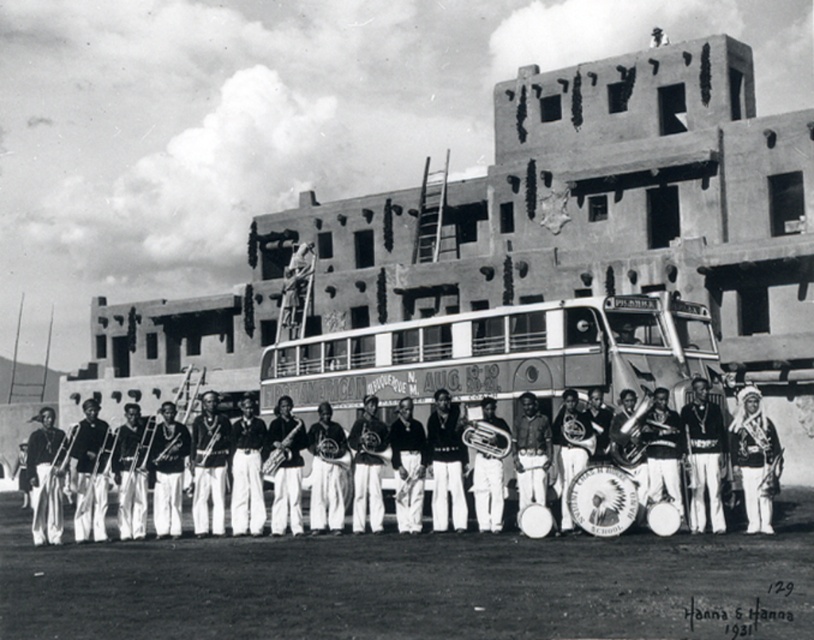
Question: Among these points, which one is nearest to the camera?

Choices:
 (A) (768, 492)
 (B) (716, 445)
 (C) (269, 433)

Answer: (A)

Question: Among these objects, which one is nearest to the camera?

Choices:
 (A) dark brown leather jacket at left
 (B) white uniform at center

Answer: (B)

Question: Does white fabric headdress at center come in front of black leather jacket at center?

Choices:
 (A) yes
 (B) no

Answer: (B)

Question: Which of the following is the farthest from the observer?

Choices:
 (A) (705, 404)
 (B) (528, 376)
 (C) (103, 397)
 (D) (90, 515)

Answer: (C)

Question: Can you confirm if metallic silver bus at center is positioned to the left of black leather jacket at center?

Choices:
 (A) no
 (B) yes

Answer: (A)

Question: Is white fabric headdress at center smaller than dark brown leather jacket at center?

Choices:
 (A) no
 (B) yes

Answer: (B)